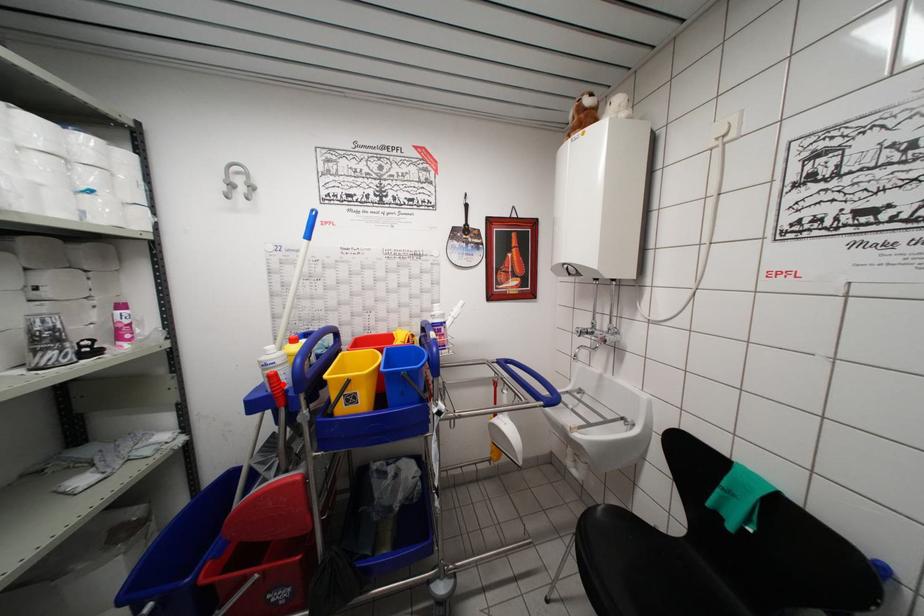
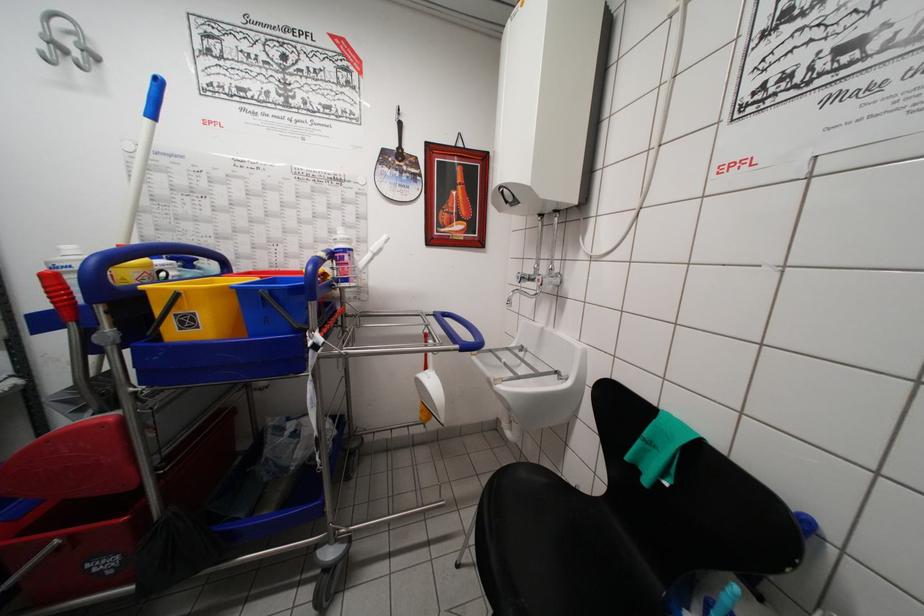
Where in the second image is the point corresponding to the highlighted location from the first image?

(67, 289)